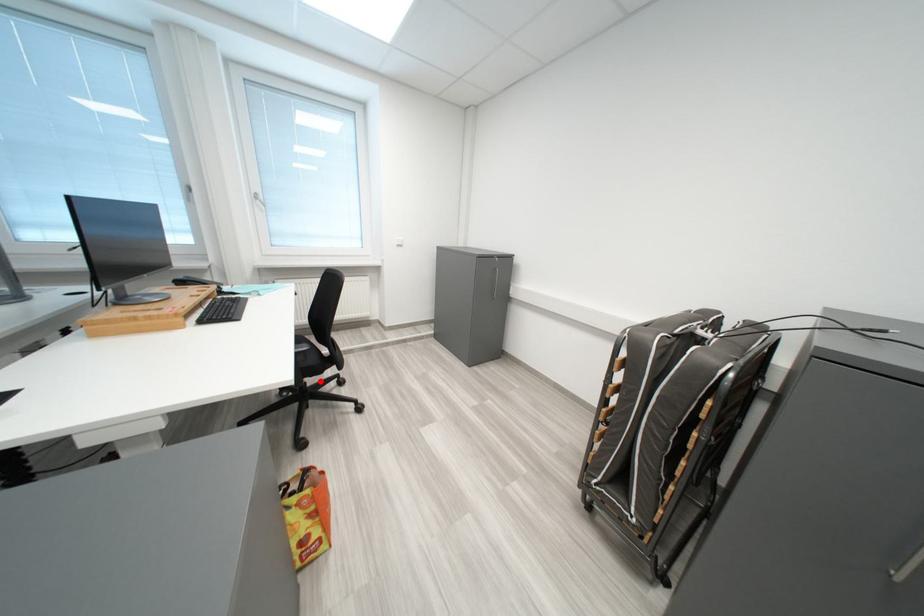
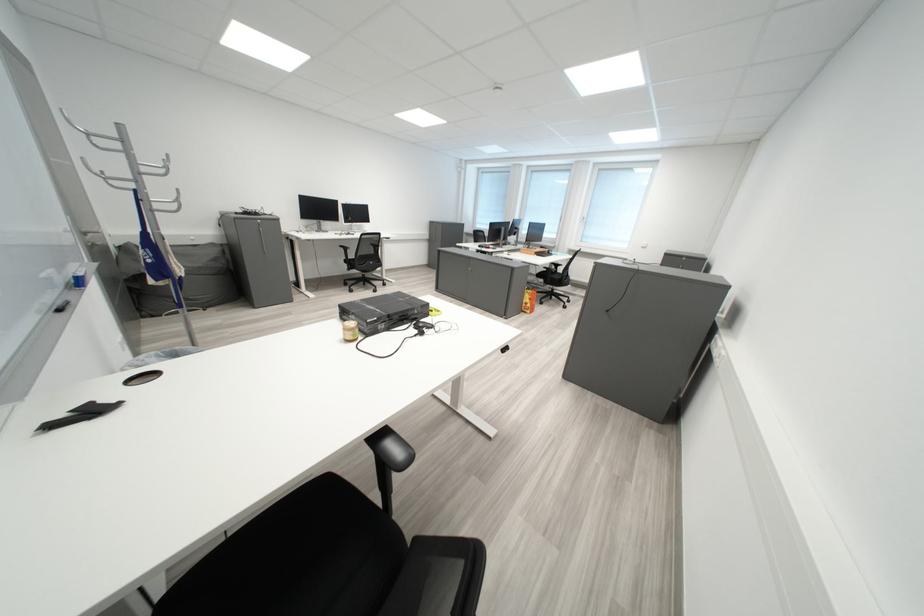
Where in the second image is the point corresponding to the highlighted location from the first image?

(567, 290)